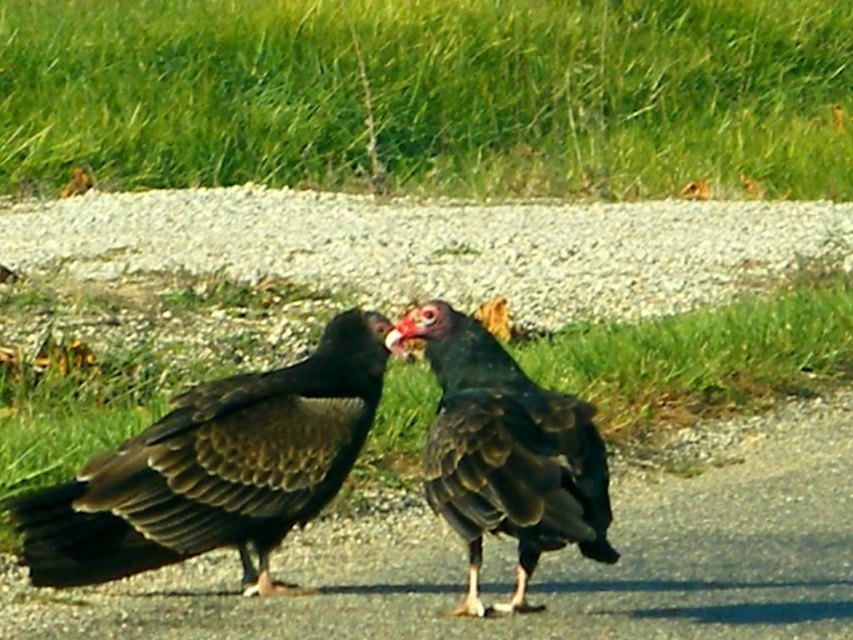
Question: Which of the following is the farthest from the observer?

Choices:
 (A) bright red beak at center
 (B) matte black vulture at center
 (C) shiny black vulture at center

Answer: (A)

Question: Is matte black vulture at center to the right of bright red beak at center from the viewer's perspective?

Choices:
 (A) no
 (B) yes

Answer: (A)

Question: Based on their relative distances, which object is nearer to the matte black vulture at center?

Choices:
 (A) shiny black vulture at center
 (B) bright red beak at center

Answer: (A)

Question: Can you confirm if shiny black vulture at center is positioned to the right of bright red beak at center?

Choices:
 (A) yes
 (B) no

Answer: (A)

Question: Among these objects, which one is farthest from the camera?

Choices:
 (A) shiny black vulture at center
 (B) bright red beak at center
 (C) matte black vulture at center

Answer: (B)

Question: Does matte black vulture at center have a greater width compared to shiny black vulture at center?

Choices:
 (A) no
 (B) yes

Answer: (B)